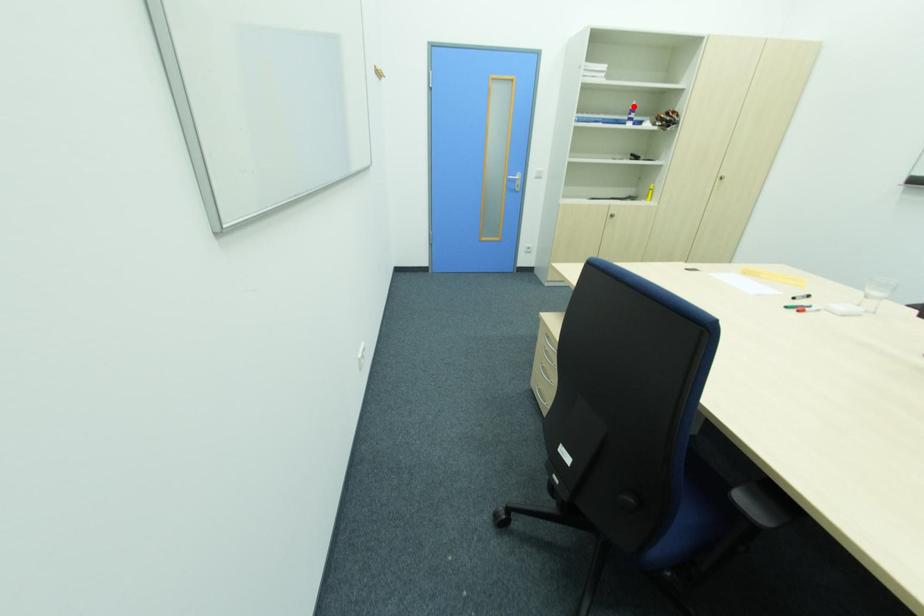
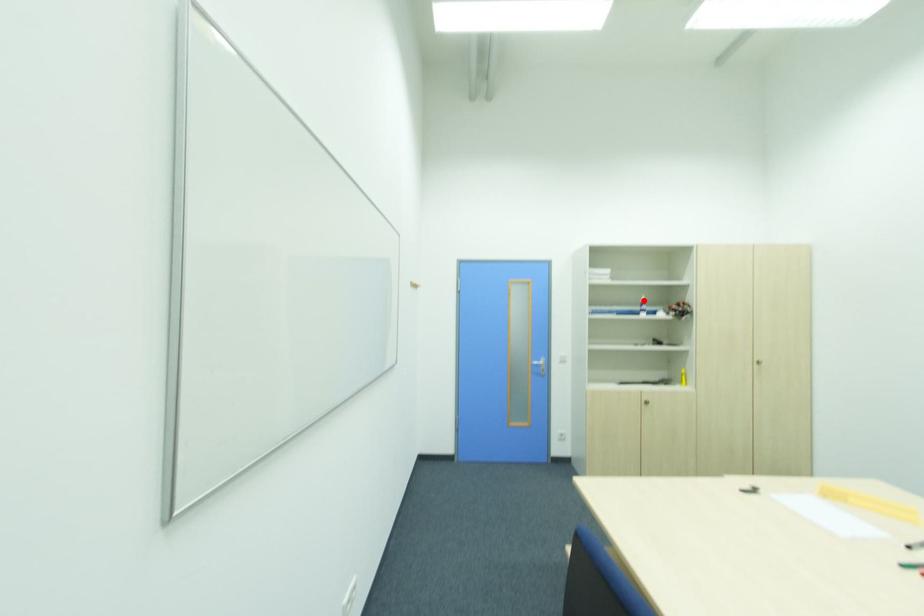
I am providing you with two images of the same scene from different viewpoints. A red point is marked on the first image and another point is marked on the second image. Do the highlighted points in image1 and image2 indicate the same real-world spot?

Yes